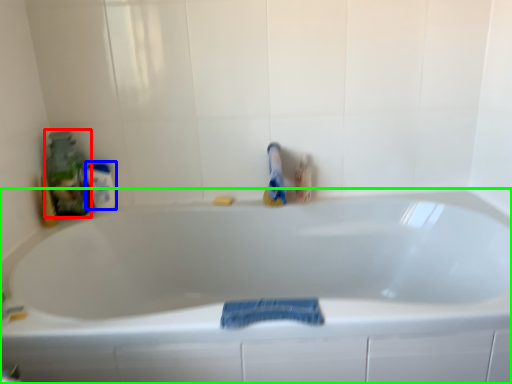
Question: Based on their relative distances, which object is farther from cleaning product (highlighted by a red box)? Choose from mouthwash (highlighted by a blue box) and bathtub (highlighted by a green box).

Choices:
 (A) mouthwash
 (B) bathtub

Answer: (B)